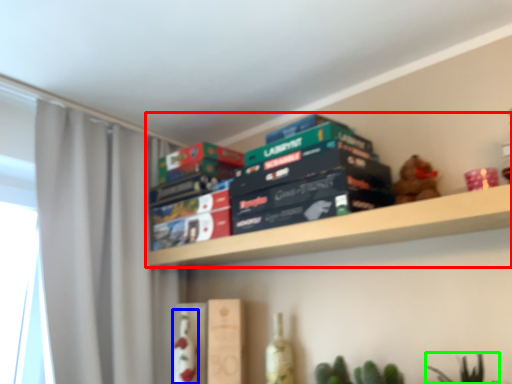
Question: Which object is the closest to the shelf (highlighted by a red box)? Choose among these: bottle (highlighted by a blue box) or plant (highlighted by a green box).

Choices:
 (A) bottle
 (B) plant

Answer: (B)